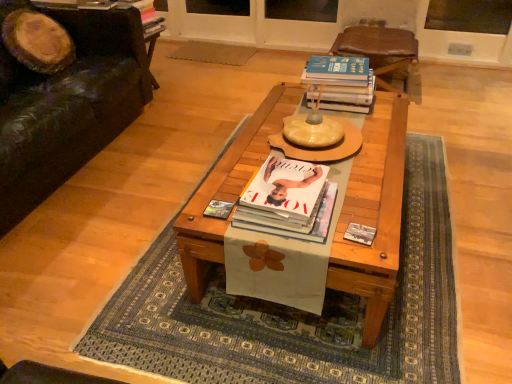
I want to click on vacant space to the right of brown leather chair at upper center, so click(449, 98).